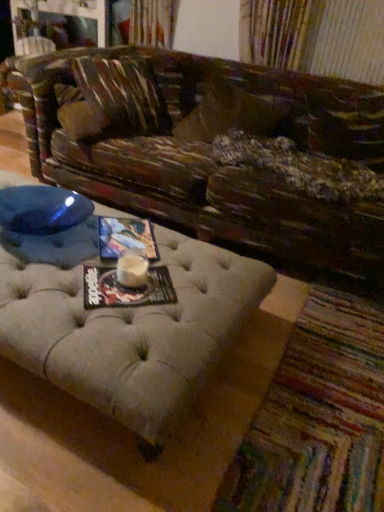
Question: Should I look upward or downward to see leather-like brown pillow at center?

Choices:
 (A) down
 (B) up

Answer: (B)

Question: In which direction should I rotate to look at matte paper magazine at center, which is counted as the 2th magazine, starting from the bottom?

Choices:
 (A) right
 (B) left

Answer: (B)

Question: Could you tell me if leather-like brown pillow at center is turned towards matte paper magazine at center, which is counted as the 2th magazine, starting from the bottom?

Choices:
 (A) no
 (B) yes

Answer: (B)

Question: Is leather-like brown pillow at center behind matte paper magazine at center, which ranks as the 2th magazine in front-to-back order?

Choices:
 (A) yes
 (B) no

Answer: (A)

Question: Is leather-like brown pillow at center closer to camera compared to matte paper magazine at center, which is counted as the 2th magazine, starting from the bottom?

Choices:
 (A) yes
 (B) no

Answer: (B)

Question: Is leather-like brown pillow at center to the left of matte paper magazine at center, the 1th magazine when ordered from top to bottom, from the viewer's perspective?

Choices:
 (A) yes
 (B) no

Answer: (B)

Question: Considering the relative sizes of leather-like brown pillow at center and matte paper magazine at center, the 1th magazine when ordered from top to bottom, in the image provided, is leather-like brown pillow at center thinner than matte paper magazine at center, the 1th magazine when ordered from top to bottom,?

Choices:
 (A) yes
 (B) no

Answer: (B)

Question: Considering the relative sizes of leather-like brown pillow at center and matte paper magazine at center, which ranks as the 2th magazine in front-to-back order, in the image provided, is leather-like brown pillow at center shorter than matte paper magazine at center, which ranks as the 2th magazine in front-to-back order,?

Choices:
 (A) yes
 (B) no

Answer: (B)

Question: Is matte paper magazine at center, which ranks as the 2th magazine in front-to-back order, smaller than beige tufted ottoman at lower center?

Choices:
 (A) no
 (B) yes

Answer: (B)

Question: Is beige tufted ottoman at lower center completely or partially inside matte paper magazine at center, positioned as the 1th magazine in back-to-front order?

Choices:
 (A) no
 (B) yes

Answer: (A)

Question: Considering the relative positions of matte paper magazine at center, which ranks as the 2th magazine in front-to-back order, and beige tufted ottoman at lower center in the image provided, is matte paper magazine at center, which ranks as the 2th magazine in front-to-back order, to the left of beige tufted ottoman at lower center from the viewer's perspective?

Choices:
 (A) yes
 (B) no

Answer: (A)

Question: Is matte paper magazine at center, which ranks as the 2th magazine in front-to-back order, at the right side of beige tufted ottoman at lower center?

Choices:
 (A) yes
 (B) no

Answer: (B)

Question: Can you confirm if matte paper magazine at center, which ranks as the 2th magazine in front-to-back order, is shorter than beige tufted ottoman at lower center?

Choices:
 (A) no
 (B) yes

Answer: (B)

Question: Can you confirm if matte paper magazine at center, the 1th magazine when ordered from top to bottom, is taller than beige tufted ottoman at lower center?

Choices:
 (A) no
 (B) yes

Answer: (A)

Question: Considering the relative sizes of matte paper magazine at center, the 2th magazine viewed from the back, and beige tufted ottoman at lower center in the image provided, is matte paper magazine at center, the 2th magazine viewed from the back, shorter than beige tufted ottoman at lower center?

Choices:
 (A) yes
 (B) no

Answer: (A)